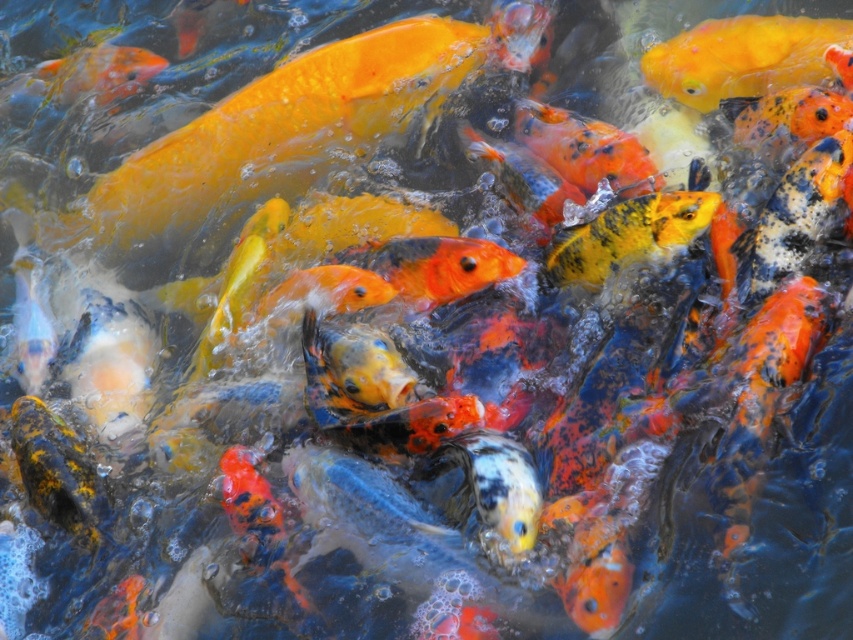
You are a photographer trying to capture a clear shot of the shiny orange fish at upper right and the yellow speckled fish at center. Since the background is blurry, which fish would you focus on to ensure it appears sharp in the photo?

The shiny orange fish at upper right is larger in size compared to the yellow speckled fish at center, so focusing on the shiny orange fish at upper right would ensure it appears sharp in the photo.

You are a photographer trying to capture a clear shot of the shiny orange fish at upper right and the orange glossy fish at upper left. Which fish is closer to the camera lens?

The shiny orange fish at upper right is closer to the camera lens because it is in front of the orange glossy fish at upper left.